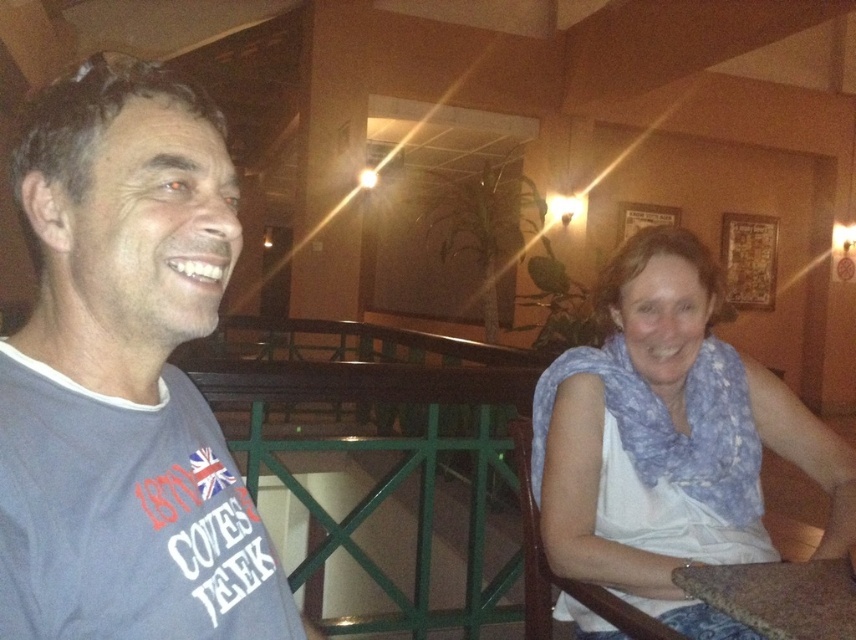
Question: Does gray t-shirt at left have a greater width compared to brown fabric table at lower right?

Choices:
 (A) yes
 (B) no

Answer: (B)

Question: Can you confirm if blue printed scarf at right is wider than brown fabric table at lower right?

Choices:
 (A) yes
 (B) no

Answer: (A)

Question: Is gray t-shirt at left below blue printed scarf at right?

Choices:
 (A) yes
 (B) no

Answer: (B)

Question: Which object is positioned closest to the blue printed scarf at right?

Choices:
 (A) gray t-shirt at left
 (B) brown fabric table at lower right

Answer: (B)

Question: Estimate the real-world distances between objects in this image. Which object is closer to the gray t-shirt at left?

Choices:
 (A) brown fabric table at lower right
 (B) blue printed scarf at right

Answer: (A)

Question: Which of the following is the closest to the observer?

Choices:
 (A) brown fabric table at lower right
 (B) gray t-shirt at left
 (C) blue printed scarf at right

Answer: (B)